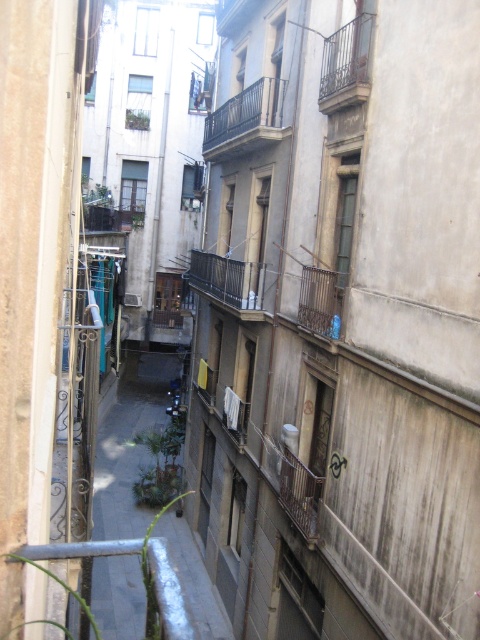
Consider the image. You are a window cleaner with a ladder that can extend to 3 meters. You need to clean both the black wrought iron balcony at center and the rusty metal balcony at upper center. Based on their sizes, which balcony will require you to extend your ladder more?

The rusty metal balcony at upper center is larger than the black wrought iron balcony at center, so you will need to extend your ladder more to reach the rusty metal balcony at upper center.

You are standing in the middle of the alleyway and want to take a photo. There are two points of interest marked in the scene. The first is at point (133, 538) and the second at point (252, 272). Which point is closer to your camera when taking the photo?

Point (133, 538) is further to the camera than point (252, 272), so the second point is closer to the camera.

You are a window cleaner standing on the ground floor of the alleyway. You need to clean both the rusty metal balcony at upper center and the rustic metal balcony at center. Which balcony should you clean first if you want to start with the one that is closer to you?

The rustic metal balcony at center is closer to you than the rusty metal balcony at upper center, so you should clean the rustic metal balcony at center first.